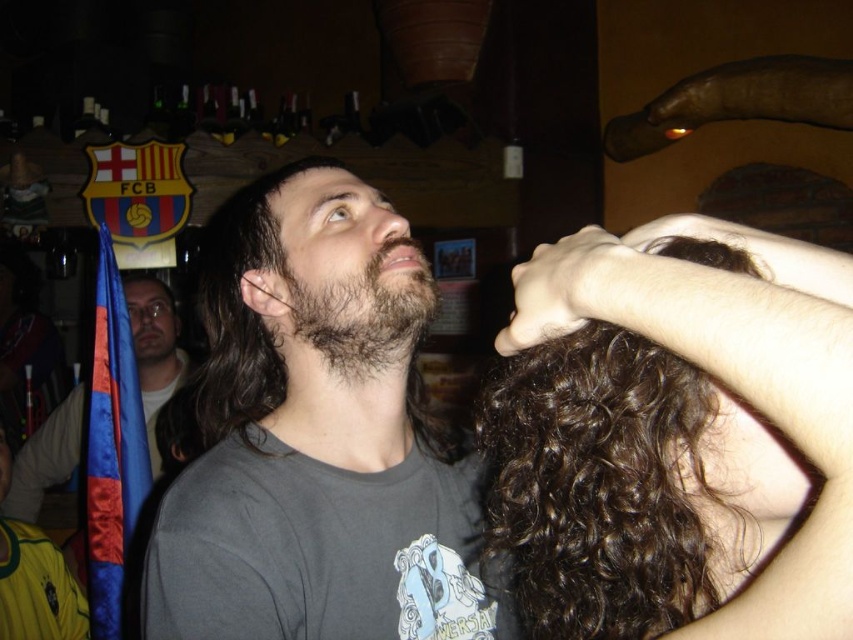
Which is above, curly brown hair at center or dark brown fuzzy beard at center?

dark brown fuzzy beard at center is above.

Which is below, curly brown hair at center or dark brown fuzzy beard at center?

curly brown hair at center is below.

Between point (608, 445) and point (381, 330), which one is positioned behind?

Point (381, 330)

Locate an element on the screen. Image resolution: width=853 pixels, height=640 pixels. curly brown hair at center is located at coordinates (674, 436).

Can you confirm if gray matte shirt at center is thinner than smooth skin hand at upper center?

No, gray matte shirt at center is not thinner than smooth skin hand at upper center.

Image resolution: width=853 pixels, height=640 pixels. I want to click on gray matte shirt at center, so click(316, 436).

Can you confirm if curly brown hair at center is thinner than smooth skin hand at upper center?

No.

You are a GUI agent. You are given a task and a screenshot of the screen. Output one action in this format:
    pyautogui.click(x=<x>, y=<y>)
    Task: Click on the curly brown hair at center
    The width and height of the screenshot is (853, 640).
    Given the screenshot: What is the action you would take?
    pyautogui.click(x=674, y=436)

Find the location of a particular element. curly brown hair at center is located at coordinates (674, 436).